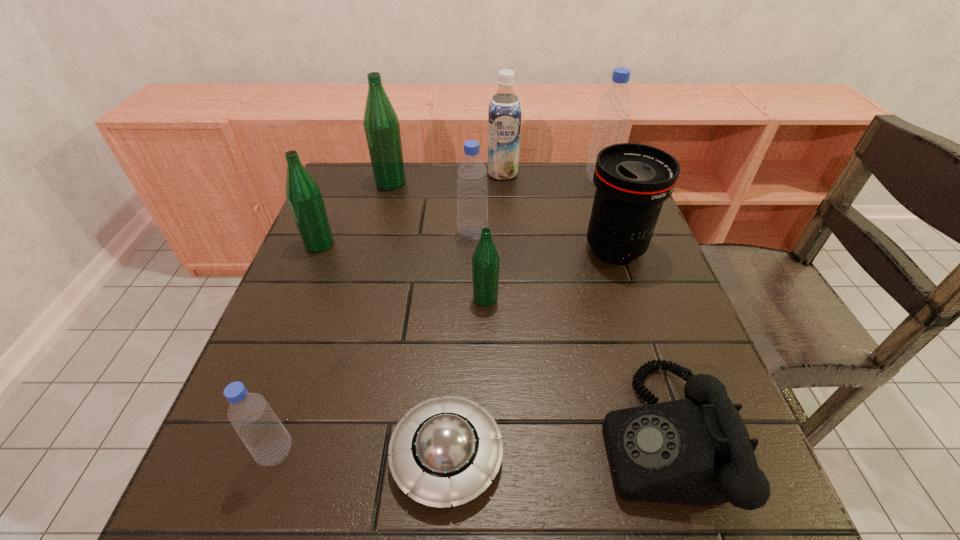
This screenshot has width=960, height=540. In order to click on bottle that is at the near edge in this screenshot , I will do (266, 438).

Identify the location of telephone at the near edge. (695, 451).

The image size is (960, 540). I want to click on saucer positioned at the near edge, so click(x=446, y=450).

The height and width of the screenshot is (540, 960). Identify the location of bottle that is at the right edge. (614, 108).

This screenshot has width=960, height=540. What are the coordinates of `telephoto lens present at the right edge` in the screenshot? It's located at (632, 181).

Where is `telephone positioned at the right edge`? telephone positioned at the right edge is located at coordinates (695, 451).

Identify the location of object that is positioned at the far left corner. 381,124.

You are a GUI agent. You are given a task and a screenshot of the screen. Output one action in this format:
    pyautogui.click(x=<x>, y=<y>)
    Task: Click on the object that is at the near left corner
    The image size is (960, 540).
    Given the screenshot: What is the action you would take?
    pyautogui.click(x=266, y=438)

Identify the location of object located in the far right corner section of the desktop. [614, 108].

This screenshot has width=960, height=540. Identify the location of object that is at the near right corner. click(x=695, y=451).